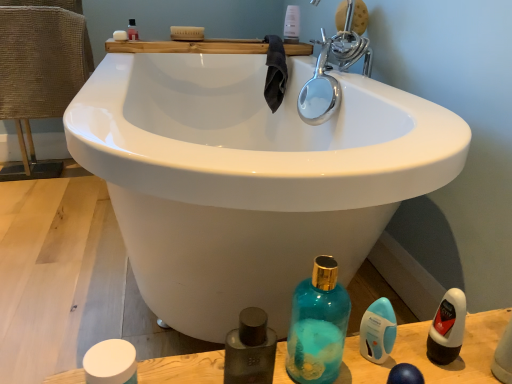
Where is `vacant region below burlap-textured chair at left (from a real-world perspective)`? This screenshot has width=512, height=384. vacant region below burlap-textured chair at left (from a real-world perspective) is located at coordinates (44, 167).